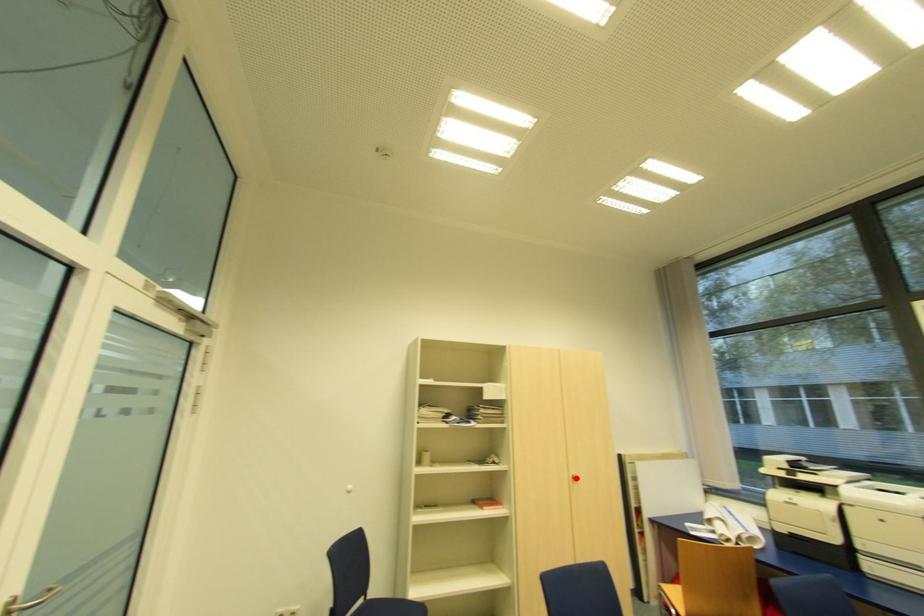
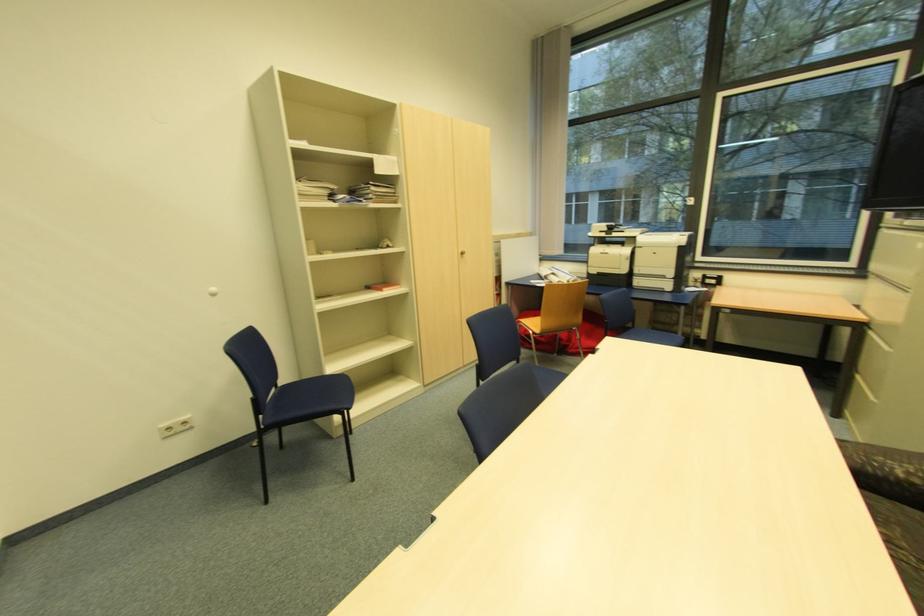
Find the pixel in the second image that matches the highlighted location in the first image.

(466, 254)